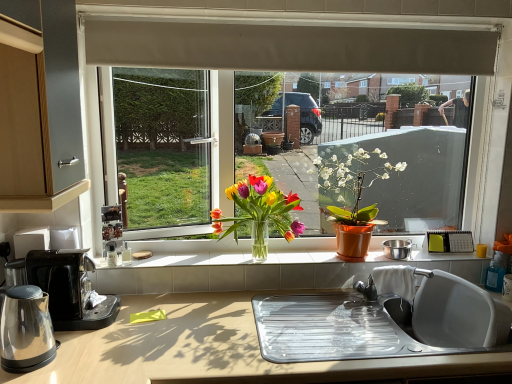
Question: Should I look upward or downward to see black plastic coffee maker at lower left?

Choices:
 (A) up
 (B) down

Answer: (B)

Question: Should I look upward or downward to see matte orange pot at center, which is counted as the second houseplant, starting from the left?

Choices:
 (A) up
 (B) down

Answer: (B)

Question: Is translucent glass vase at center, placed as the 1th houseplant when sorted from left to right, smaller than black plastic coffee maker at lower left?

Choices:
 (A) no
 (B) yes

Answer: (A)

Question: Is translucent glass vase at center, placed as the 1th houseplant when sorted from left to right, to the left of black plastic coffee maker at lower left from the viewer's perspective?

Choices:
 (A) no
 (B) yes

Answer: (A)

Question: From the image's perspective, is translucent glass vase at center, placed as the 1th houseplant when sorted from left to right, over black plastic coffee maker at lower left?

Choices:
 (A) no
 (B) yes

Answer: (B)

Question: Is translucent glass vase at center, which is the 2th houseplant in right-to-left order, touching black plastic coffee maker at lower left?

Choices:
 (A) yes
 (B) no

Answer: (B)

Question: From a real-world perspective, is translucent glass vase at center, placed as the 1th houseplant when sorted from left to right, below black plastic coffee maker at lower left?

Choices:
 (A) yes
 (B) no

Answer: (B)

Question: Is translucent glass vase at center, which is the 2th houseplant in right-to-left order, thinner than black plastic coffee maker at lower left?

Choices:
 (A) no
 (B) yes

Answer: (B)

Question: From a real-world perspective, is beige fabric exhaust hood at upper center over black plastic coffee maker at lower left?

Choices:
 (A) no
 (B) yes

Answer: (B)

Question: Could you tell me if beige fabric exhaust hood at upper center is facing black plastic coffee maker at lower left?

Choices:
 (A) yes
 (B) no

Answer: (B)

Question: Does beige fabric exhaust hood at upper center appear on the left side of black plastic coffee maker at lower left?

Choices:
 (A) no
 (B) yes

Answer: (A)

Question: From a real-world perspective, is beige fabric exhaust hood at upper center located beneath black plastic coffee maker at lower left?

Choices:
 (A) no
 (B) yes

Answer: (A)

Question: From the image's perspective, does beige fabric exhaust hood at upper center appear lower than black plastic coffee maker at lower left?

Choices:
 (A) no
 (B) yes

Answer: (A)

Question: Is the position of beige fabric exhaust hood at upper center less distant than that of black plastic coffee maker at lower left?

Choices:
 (A) yes
 (B) no

Answer: (B)

Question: Does matte orange pot at center, acting as the 1th houseplant starting from the right, have a larger size compared to transparent glass window at center?

Choices:
 (A) no
 (B) yes

Answer: (A)